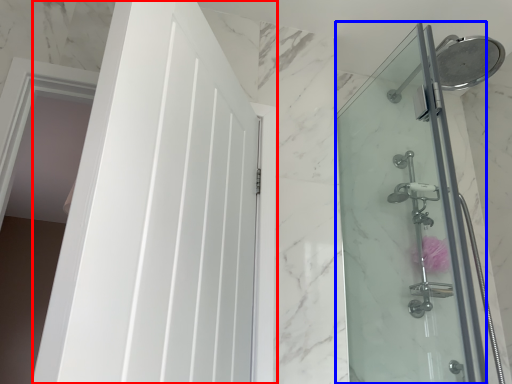
Question: Which point is closer to the camera, door (highlighted by a red box) or screen door (highlighted by a blue box)?

Choices:
 (A) door
 (B) screen door

Answer: (A)